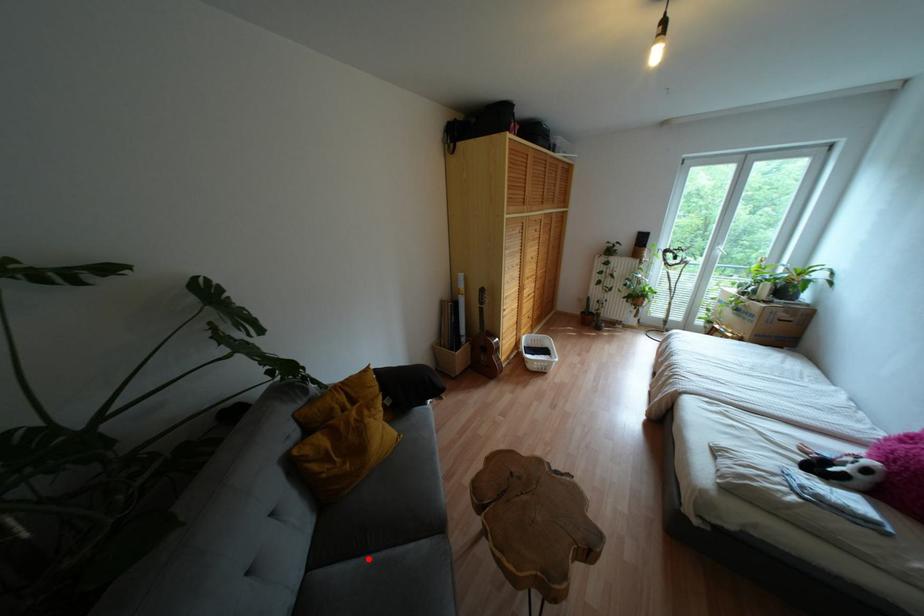
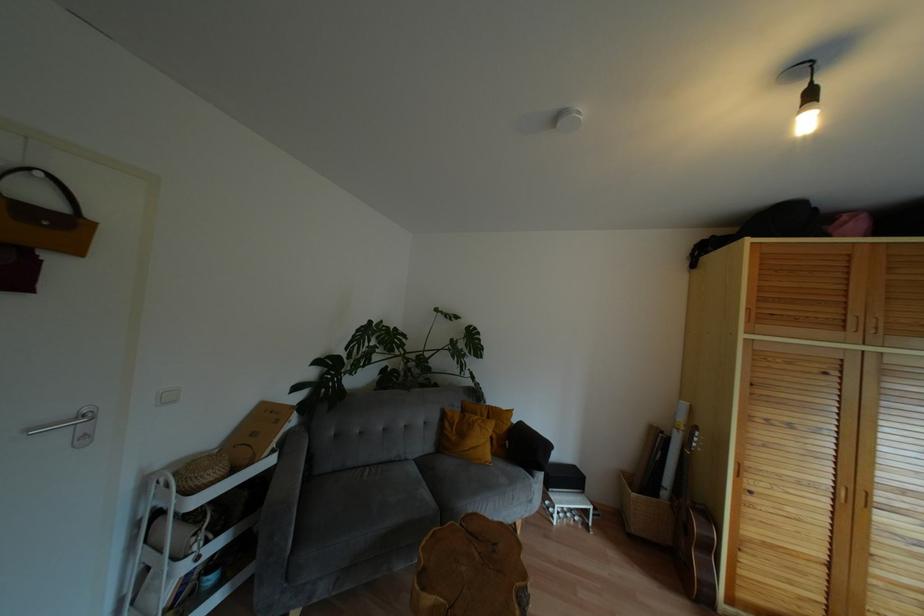
In the second image, find the point that corresponds to the highlighted location in the first image.

(419, 476)